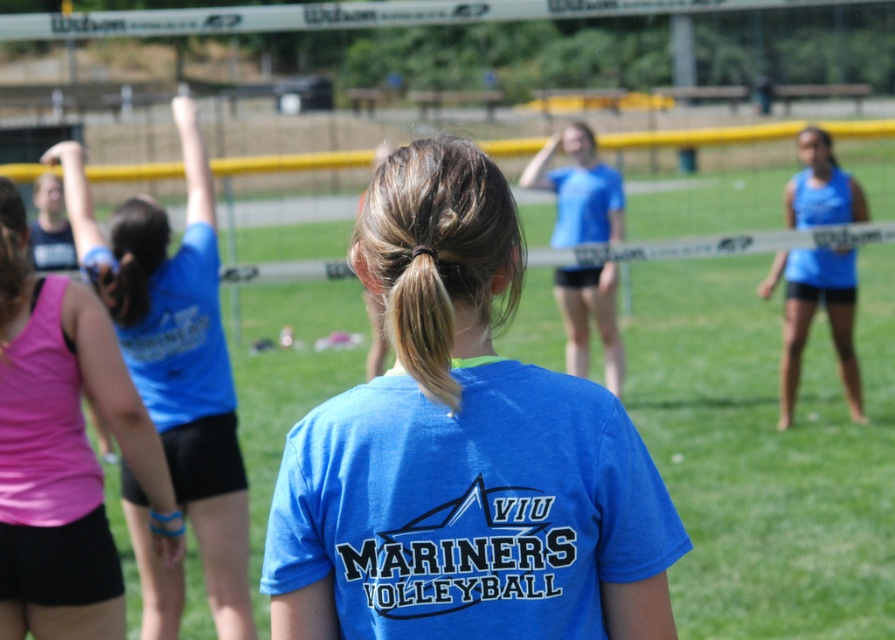
Is pink fabric shorts at left taller than blue matte shorts at right?

In fact, pink fabric shorts at left may be shorter than blue matte shorts at right.

Locate an element on the screen. This screenshot has height=640, width=895. pink fabric shorts at left is located at coordinates (62, 451).

This screenshot has height=640, width=895. What are the coordinates of `pink fabric shorts at left` in the screenshot? It's located at (62, 451).

This screenshot has height=640, width=895. What do you see at coordinates (177, 355) in the screenshot?
I see `blue jersey at upper left` at bounding box center [177, 355].

Which is in front, point (111, 300) or point (834, 273)?

Point (111, 300) is more forward.

Locate an element on the screen. The image size is (895, 640). blue jersey at upper left is located at coordinates (177, 355).

Which of these two, blue matte shirt at center or blue matte shorts at right, stands taller?

Standing taller between the two is blue matte shorts at right.

Measure the distance between blue matte shirt at center and camera.

→ A distance of 9.71 feet exists between blue matte shirt at center and camera.

The height and width of the screenshot is (640, 895). I want to click on blue matte shirt at center, so click(462, 451).